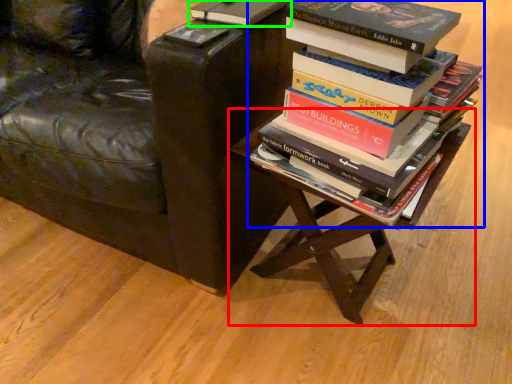
Question: Estimate the real-world distances between objects in this image. Which object is closer to table (highlighted by a red box), book (highlighted by a blue box) or book (highlighted by a green box)?

Choices:
 (A) book
 (B) book

Answer: (A)